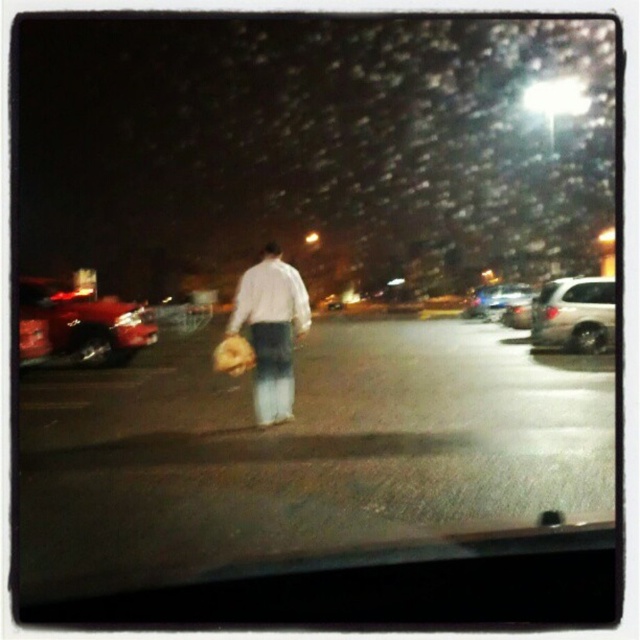
You are driving a car that is 1.8 meters wide and want to park in the parking lot shown. The shiny red car at left and the satin silver suv at right are parked next to each other. Can your car fit between them?

The shiny red car at left is narrower than the satin silver suv at right. However, without knowing the exact distance between them, it is impossible to determine if your 1.8 meter wide car can fit between the two vehicles.

You are a valet parking attendant who needs to park both the satin silver suv at right and the metallic silver sedan at right in a tight space. Based on their sizes, which vehicle should you park first to maximize space efficiency?

The metallic silver sedan at right is smaller than the satin silver suv at right. Therefore, you should park the metallic silver sedan at right first to fit it into the tighter spots before accommodating the larger satin silver suv at right.